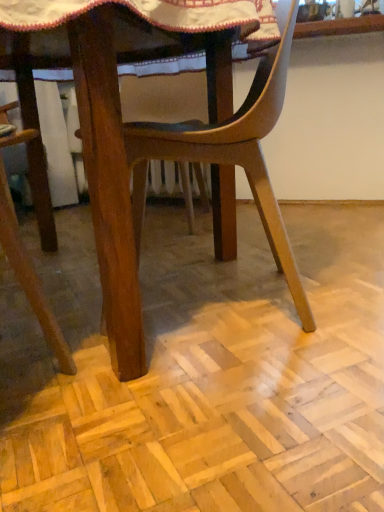
Where is `free location to the right of wooden chair at center`? The image size is (384, 512). free location to the right of wooden chair at center is located at coordinates (353, 283).